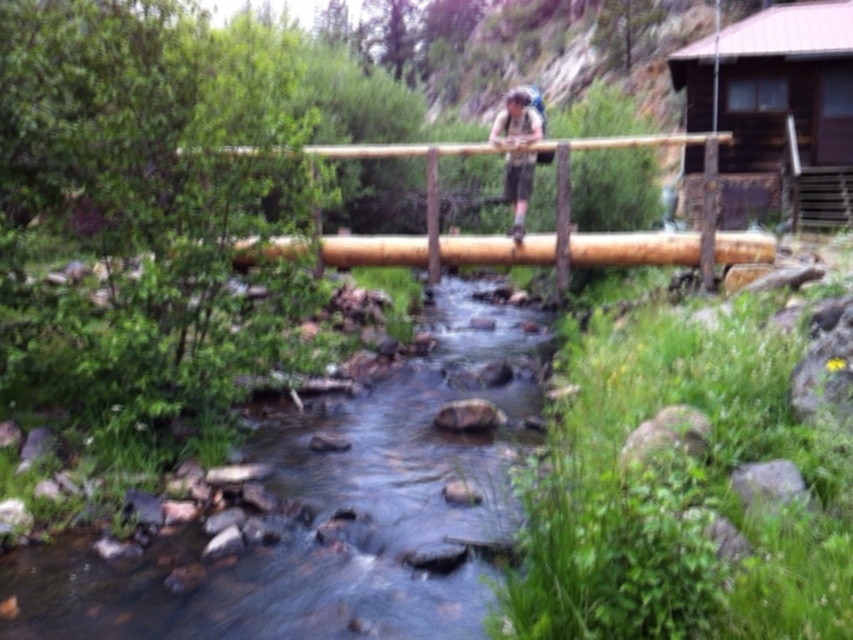
You are a hiker who wants to cross the stream using the wooden bridge. You notice the clear water at center and the brown wooden pole at upper right. Which object is closer to the left side of the bridge?

The clear water at center is to the left of the brown wooden pole at upper right, so the clear water at center is closer to the left side of the bridge.

You are standing on the wooden bridge and want to take a photo of the brown wooden rail at center and the brown wooden pole at upper right. Which object should you point your camera towards first if you need to capture them from left to right in the frame?

The brown wooden rail at center should be captured first as it is positioned to the left of the brown wooden pole at upper right.

You are standing at the starting point of the bridge and want to reach the brown wooden rail at center. Which direction should you move towards?

The brown wooden rail at center is located at point (500, 241), so you should move towards the center of the bridge to reach it.